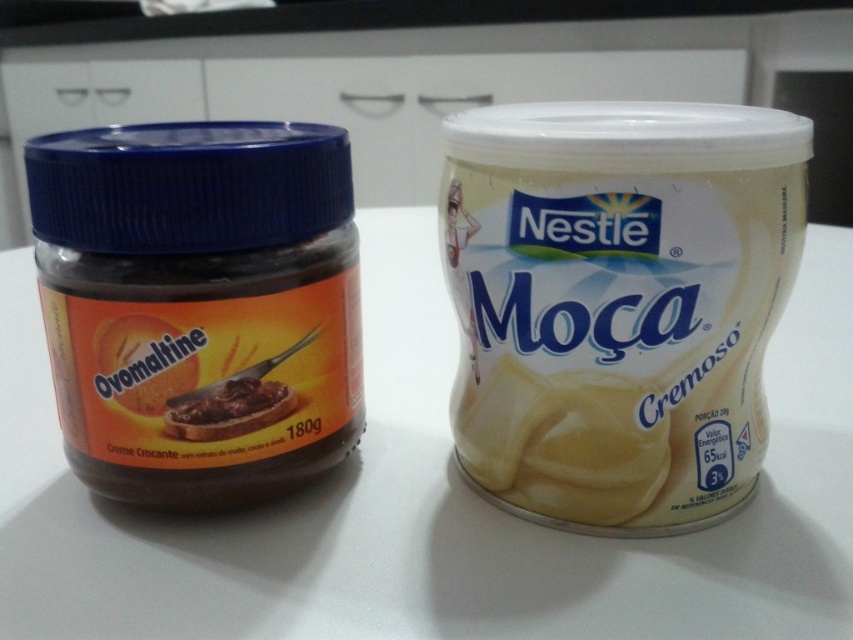
Question: Among these objects, which one is farthest from the camera?

Choices:
 (A) white creamy tub at center
 (B) dark brown creamy spread at left

Answer: (B)

Question: Among these objects, which one is farthest from the camera?

Choices:
 (A) white creamy tub at center
 (B) dark brown creamy spread at left

Answer: (B)

Question: From the image, what is the correct spatial relationship of white creamy tub at center in relation to dark brown creamy spread at left?

Choices:
 (A) above
 (B) below

Answer: (A)

Question: Is white creamy tub at center closer to the viewer compared to dark brown creamy spread at left?

Choices:
 (A) no
 (B) yes

Answer: (B)

Question: From the image, what is the correct spatial relationship of white creamy tub at center in relation to dark brown creamy spread at left?

Choices:
 (A) right
 (B) left

Answer: (A)